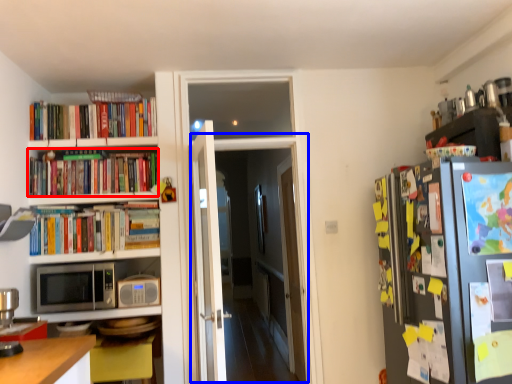
Question: Which object is further to the camera taking this photo, book (highlighted by a red box) or glass door (highlighted by a blue box)?

Choices:
 (A) book
 (B) glass door

Answer: (A)